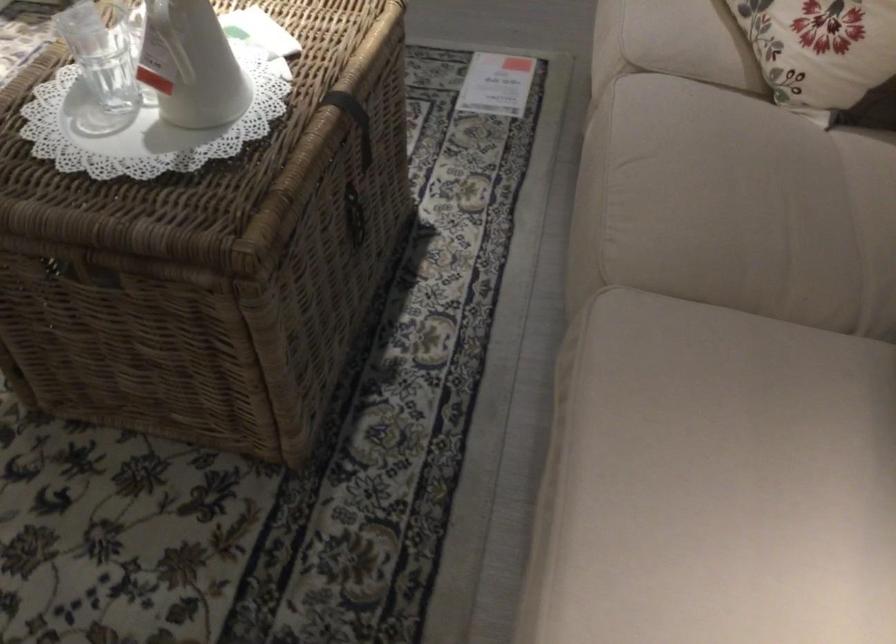
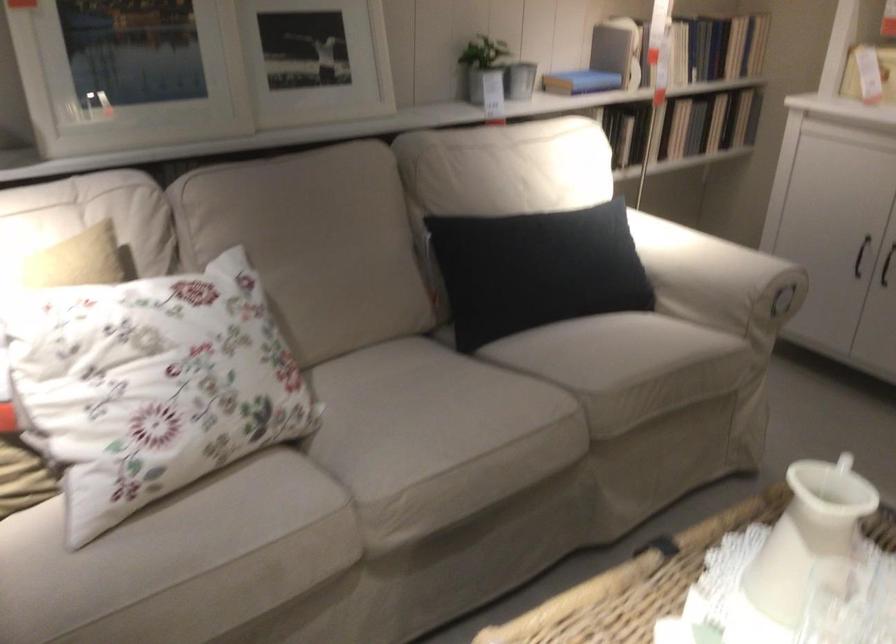
The point at (x=616, y=104) is marked in the first image. Where is the corresponding point in the second image?

(398, 494)